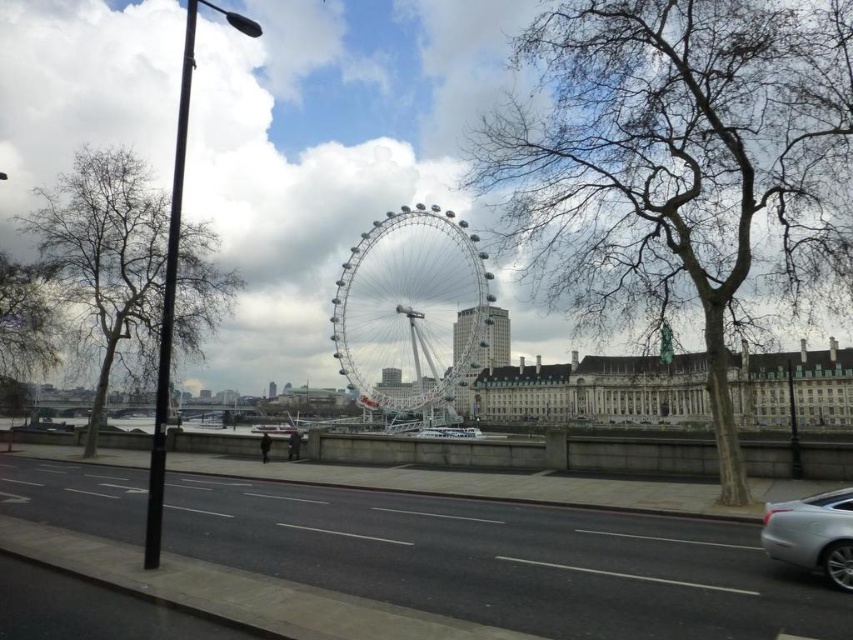
Who is shorter, white metallic ferris wheel at center or silver metallic car at lower right?

With less height is silver metallic car at lower right.

What do you see at coordinates (412, 310) in the screenshot?
I see `white metallic ferris wheel at center` at bounding box center [412, 310].

Which is behind, point (339, 291) or point (805, 547)?

Point (339, 291)

Identify the location of white metallic ferris wheel at center. The width and height of the screenshot is (853, 640). (412, 310).

Who is higher up, bare wood tree at center or white metallic ferris wheel at center?

Positioned higher is bare wood tree at center.

Who is more forward, (787, 42) or (341, 275)?

Point (787, 42)

The width and height of the screenshot is (853, 640). Find the location of `bare wood tree at center`. bare wood tree at center is located at coordinates (682, 168).

Is white metallic ferris wheel at center wider than metallic silver tower at center?

Yes.

In the scene shown: Between white metallic ferris wheel at center and metallic silver tower at center, which one appears on the right side from the viewer's perspective?

metallic silver tower at center is more to the right.

The width and height of the screenshot is (853, 640). What do you see at coordinates (412, 310) in the screenshot? I see `white metallic ferris wheel at center` at bounding box center [412, 310].

At what (x,y) coordinates should I click in order to perform the action: click on white metallic ferris wheel at center. Please return your answer as a coordinate pair (x, y). Looking at the image, I should click on (412, 310).